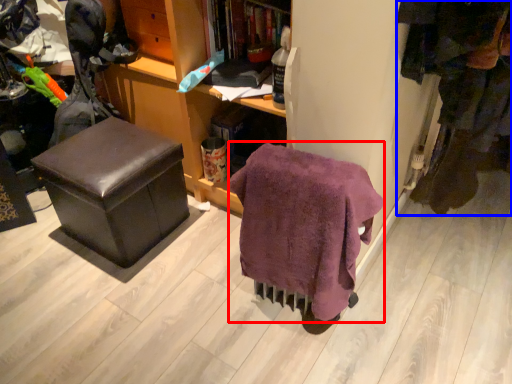
Question: Which point is further to the camera, blanket (highlighted by a red box) or clothing (highlighted by a blue box)?

Choices:
 (A) blanket
 (B) clothing

Answer: (B)